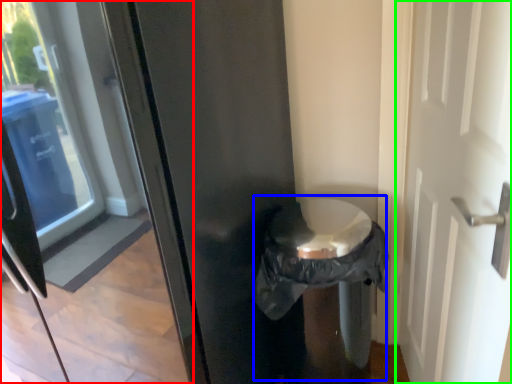
Question: Which is nearer to the glass door (highlighted by a red box)? garbage (highlighted by a blue box) or door (highlighted by a green box).

Choices:
 (A) garbage
 (B) door

Answer: (A)